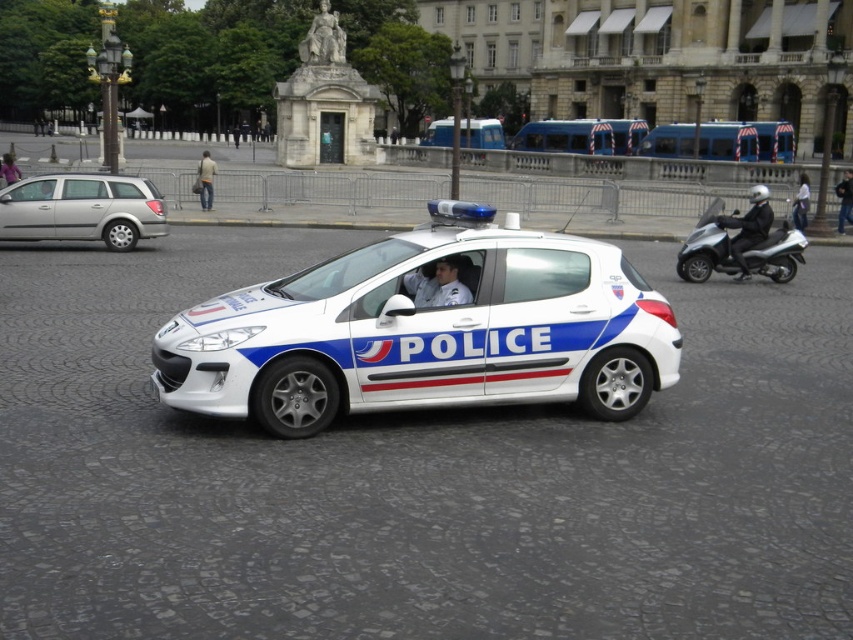
Question: Which point is closer to the camera?

Choices:
 (A) white glossy motorcycle at right
 (B) blue metallic bus at center
 (C) silver metallic station wagon at left

Answer: (A)

Question: Is silver metallic station wagon at left further to the viewer compared to white glossy motorcycle at right?

Choices:
 (A) no
 (B) yes

Answer: (B)

Question: In this image, where is silver metallic scooter at right located relative to white glossy motorcycle at right?

Choices:
 (A) above
 (B) below

Answer: (B)

Question: Which of the following is the closest to the observer?

Choices:
 (A) (120, 234)
 (B) (701, 268)

Answer: (B)

Question: Which point is farther from the camera taking this photo?

Choices:
 (A) (165, 232)
 (B) (740, 228)

Answer: (A)

Question: Is blue metallic bus at center to the right of blue metallic van at center from the viewer's perspective?

Choices:
 (A) no
 (B) yes

Answer: (B)